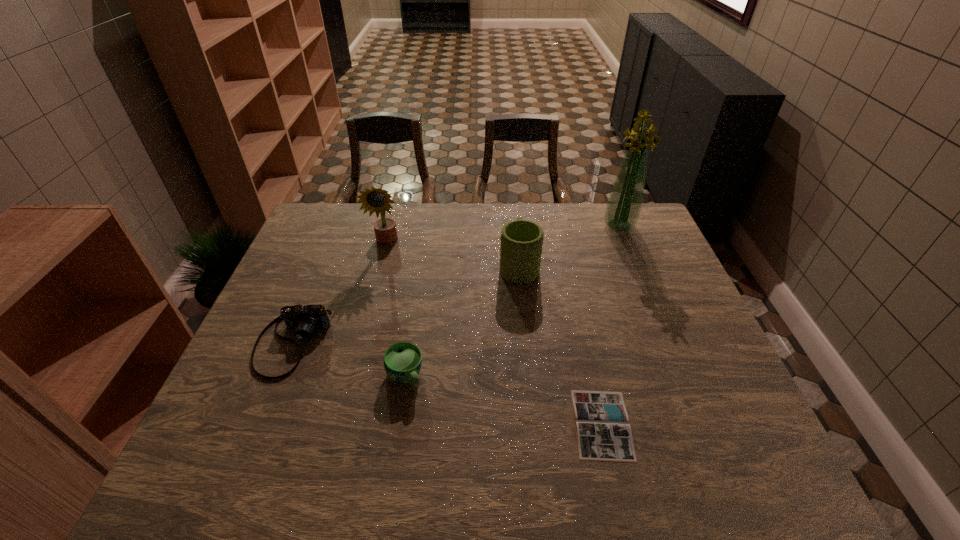
The image size is (960, 540). I want to click on vacant point located 0.090m on the front-facing side of the bouquet, so click(x=630, y=252).

This screenshot has height=540, width=960. Find the location of `vacant space located 0.070m on the face of the sunflower`. vacant space located 0.070m on the face of the sunflower is located at coordinates (380, 267).

At what (x,y) coordinates should I click in order to perform the action: click on free region located 0.120m on the side of the third tallest object with the handle. Please return your answer as a coordinate pair (x, y). This screenshot has height=540, width=960. Looking at the image, I should click on 515,226.

Find the location of a particular element. vacant space located on the side of the third tallest object with the handle is located at coordinates (516, 231).

The width and height of the screenshot is (960, 540). Find the location of `vacant space located on the side of the third tallest object with the handle`. vacant space located on the side of the third tallest object with the handle is located at coordinates (513, 205).

The height and width of the screenshot is (540, 960). Identify the location of vacant space located 0.190m on the right of the cup. (503, 376).

Locate an element on the screen. vacant space situated 0.230m on the front-facing side of the leftmost object is located at coordinates (239, 477).

You are a GUI agent. You are given a task and a screenshot of the screen. Output one action in this format:
    pyautogui.click(x=<x>, y=<y>)
    Task: Click on the vacant space located 0.250m on the back of the second object from right to left
    This screenshot has height=540, width=960.
    Given the screenshot: What is the action you would take?
    pyautogui.click(x=577, y=312)

Identify the location of bouquet present at the far edge. This screenshot has width=960, height=540. (623, 208).

Locate an element on the screen. sunflower at the far edge is located at coordinates (376, 200).